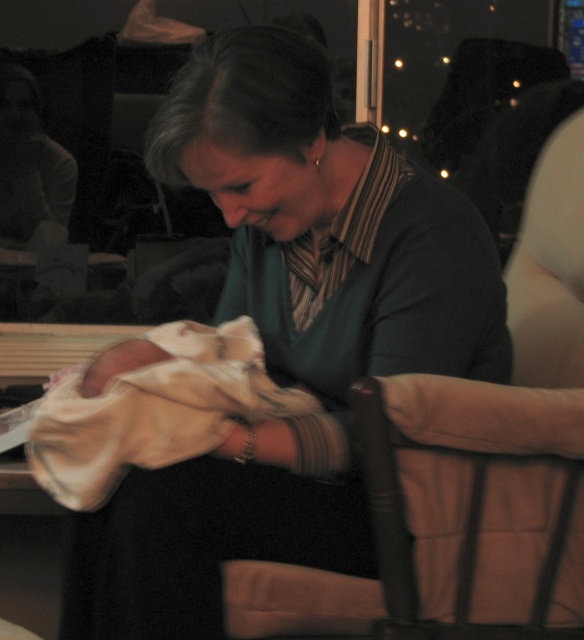
You are a photographer adjusting the focus of a camera. The camera has two focus points displayed on the screen at point (540, 444) and point (276, 413). Based on the scene, which focus point is closer to the photographer?

Point (540, 444) is in front of point (276, 413), so the focus point at point (540, 444) is closer to the photographer.

You are a furniture designer trying to place a new decorative pillow on the brown fabric armchair at center. The pillow is 1.2 meters wide. Can the soft white blanket at center currently on the armchair accommodate the pillow without folding?

The brown fabric armchair at center might be wider than the soft white blanket at center, so there is a possibility that the soft white blanket at center could accommodate the pillow without folding if the armchair is indeed wider. However, since the exact width of the armchair isn not specified, it is uncertain.

Looking at this image, you are standing in the room and want to sit down in the brown fabric armchair at center. Based on its position, where should you walk to find it?

→ The brown fabric armchair at center is located at point [509,432], so you should walk towards that coordinate to find it.